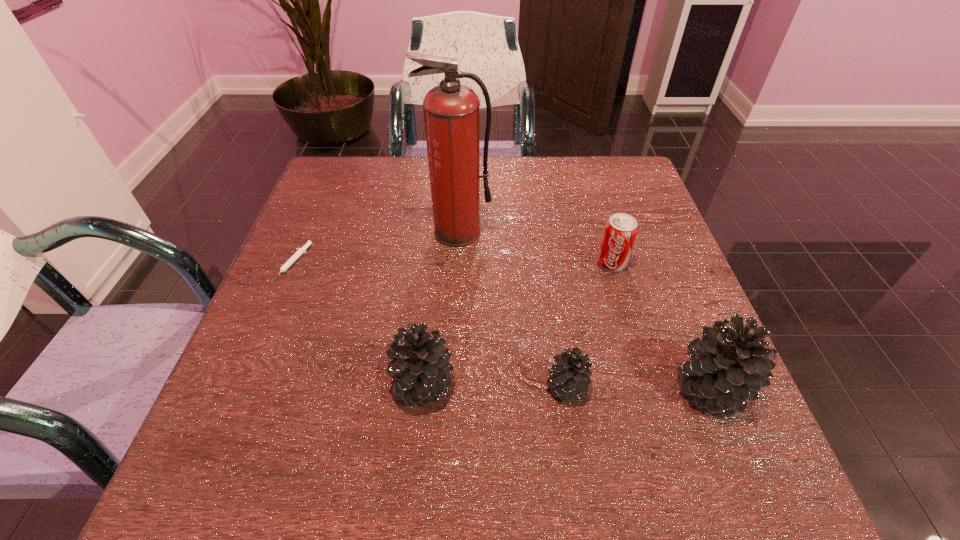
You are a GUI agent. You are given a task and a screenshot of the screen. Output one action in this format:
    pyautogui.click(x=<x>, y=<y>)
    Task: Click on the vacant space at the far edge of the desktop
    Image resolution: width=960 pixels, height=540 pixels.
    Given the screenshot: What is the action you would take?
    pyautogui.click(x=548, y=181)

You are a GUI agent. You are given a task and a screenshot of the screen. Output one action in this format:
    pyautogui.click(x=<x>, y=<y>)
    Task: Click on the vacant space at the near edge of the desktop
    The image size is (960, 540).
    Given the screenshot: What is the action you would take?
    pyautogui.click(x=590, y=421)

This screenshot has width=960, height=540. In the image, there is a desktop. In order to click on vacant space at the left edge in this screenshot , I will do `click(294, 264)`.

In the image, there is a desktop. Where is `vacant area at the far right corner`? vacant area at the far right corner is located at coordinates (604, 173).

Find the location of a particular element. This screenshot has height=540, width=960. vacant space at the near right corner of the desktop is located at coordinates (658, 398).

At what (x,y) coordinates should I click in order to perform the action: click on free area in between the leftmost pinecone and the tallest object. Please return your answer as a coordinate pair (x, y). The image size is (960, 540). Looking at the image, I should click on pos(441,308).

Find the location of a particular element. free spot between the fourth tallest object and the shortest object is located at coordinates (452, 263).

The height and width of the screenshot is (540, 960). I want to click on free spot between the rightmost object and the leftmost object, so click(x=502, y=326).

Identify the location of free space between the leftmost object and the rightmost object. The height and width of the screenshot is (540, 960). (502, 326).

I want to click on free area in between the leftmost pinecone and the soda can, so [517, 323].